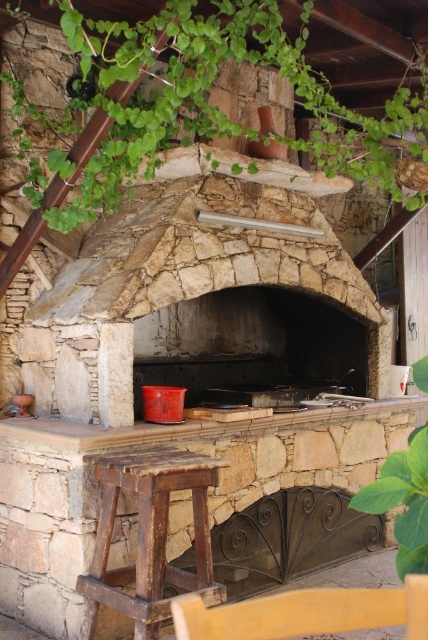
The width and height of the screenshot is (428, 640). What are the coordinates of `natural stone fireplace at center` in the screenshot? It's located at (184, 273).

Can you confirm if natural stone fireplace at center is wider than wooden chair at lower center?

Indeed, natural stone fireplace at center has a greater width compared to wooden chair at lower center.

Describe the element at coordinates (184, 273) in the screenshot. I see `natural stone fireplace at center` at that location.

Find the location of a particular element. This screenshot has height=640, width=428. natural stone fireplace at center is located at coordinates (184, 273).

Who is positioned more to the right, wooden chair at lower center or green leafy plant at lower right?

green leafy plant at lower right is more to the right.

Can you confirm if wooden chair at lower center is thinner than green leafy plant at lower right?

Incorrect, wooden chair at lower center's width is not less than green leafy plant at lower right's.

What do you see at coordinates (306, 612) in the screenshot? I see `wooden chair at lower center` at bounding box center [306, 612].

This screenshot has height=640, width=428. What are the coordinates of `wooden chair at lower center` in the screenshot? It's located at (306, 612).

Who is more forward, [35,170] or [365,355]?

Positioned in front is point [35,170].

Does green leafy plant at upper center appear on the right side of dark gray stone fireplace at center?

Indeed, green leafy plant at upper center is positioned on the right side of dark gray stone fireplace at center.

Is point (137, 29) positioned behind point (312, 330)?

No, (137, 29) is in front of (312, 330).

The height and width of the screenshot is (640, 428). I want to click on green leafy plant at upper center, so click(207, 93).